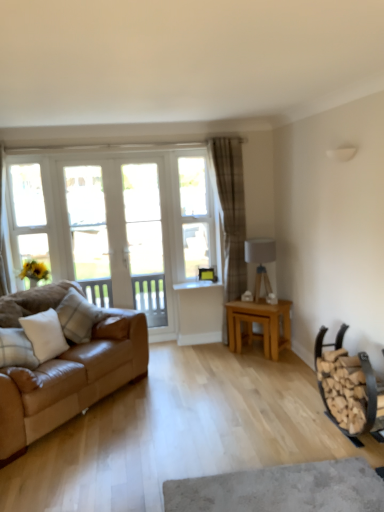
Question: Is the position of white painted wood window frame at left more distant than that of clear glass window at center?

Choices:
 (A) yes
 (B) no

Answer: (B)

Question: Is white painted wood window frame at left thinner than clear glass window at center?

Choices:
 (A) no
 (B) yes

Answer: (B)

Question: Is white painted wood window frame at left aimed at clear glass window at center?

Choices:
 (A) no
 (B) yes

Answer: (A)

Question: From a real-world perspective, is white painted wood window frame at left over clear glass window at center?

Choices:
 (A) yes
 (B) no

Answer: (A)

Question: Considering the relative sizes of white painted wood window frame at left and clear glass window at center in the image provided, is white painted wood window frame at left smaller than clear glass window at center?

Choices:
 (A) yes
 (B) no

Answer: (A)

Question: Considering the relative positions of brown plaid curtain at center and plaid fabric pillow at left, which appears as the 2th pillow when viewed from the front, in the image provided, is brown plaid curtain at center to the left or to the right of plaid fabric pillow at left, which appears as the 2th pillow when viewed from the front,?

Choices:
 (A) right
 (B) left

Answer: (A)

Question: Choose the correct answer: Is brown plaid curtain at center inside plaid fabric pillow at left, which appears as the 2th pillow when viewed from the front, or outside it?

Choices:
 (A) outside
 (B) inside

Answer: (A)

Question: Is brown plaid curtain at center in front of or behind plaid fabric pillow at left, acting as the first pillow starting from the back, in the image?

Choices:
 (A) front
 (B) behind

Answer: (B)

Question: Is point (218, 160) positioned closer to the camera than point (74, 312)?

Choices:
 (A) closer
 (B) farther

Answer: (B)

Question: Which is correct: white cotton pillow at left, which ranks as the second pillow in back-to-front order, is inside wooden firewood rack at lower right, or outside of it?

Choices:
 (A) inside
 (B) outside

Answer: (B)

Question: Is white cotton pillow at left, the 1th pillow when ordered from front to back, bigger or smaller than wooden firewood rack at lower right?

Choices:
 (A) big
 (B) small

Answer: (B)

Question: From the image's perspective, is white cotton pillow at left, which ranks as the second pillow in back-to-front order, above or below wooden firewood rack at lower right?

Choices:
 (A) above
 (B) below

Answer: (A)

Question: Is white cotton pillow at left, which ranks as the second pillow in back-to-front order, taller or shorter than wooden firewood rack at lower right?

Choices:
 (A) tall
 (B) short

Answer: (B)

Question: Is clear glass screen door at center, which is the 1th screen door in right-to-left order, taller or shorter than brown plaid curtain at center?

Choices:
 (A) tall
 (B) short

Answer: (B)

Question: From a real-world perspective, is clear glass screen door at center, which is the second screen door in left-to-right order, physically located above or below brown plaid curtain at center?

Choices:
 (A) below
 (B) above

Answer: (A)